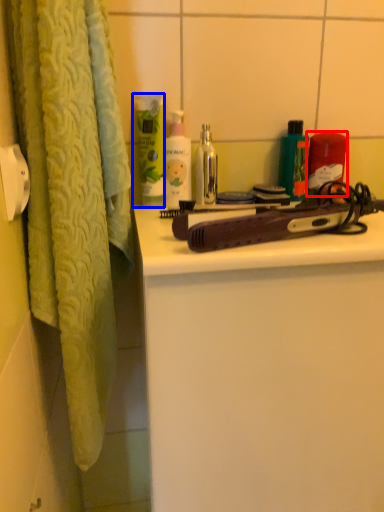
Question: Which point is closer to the camera, product (highlighted by a red box) or cleaning product (highlighted by a blue box)?

Choices:
 (A) product
 (B) cleaning product

Answer: (B)